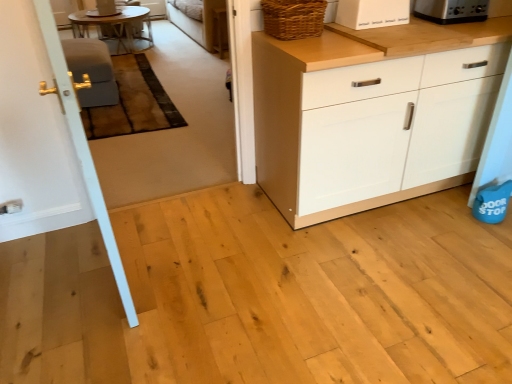
Describe the element at coordinates (293, 18) in the screenshot. This screenshot has width=512, height=384. I see `woven brown basket at upper right` at that location.

At what (x,y) coordinates should I click in order to perform the action: click on wooden round table at upper left. Please return your answer as a coordinate pair (x, y). Looking at the image, I should click on (116, 28).

What do you see at coordinates (46, 138) in the screenshot?
I see `white painted wood door at left` at bounding box center [46, 138].

Find the location of a particular element. beige fabric couch at upper center is located at coordinates (195, 19).

Is beige fabric couch at upper center positioned with its back to white wood cabinet at center?

beige fabric couch at upper center does not have its back to white wood cabinet at center.

Is point (167, 11) positioned before point (385, 38)?

No, (167, 11) is behind (385, 38).

Does beige fabric couch at upper center touch white wood cabinet at center?

No, beige fabric couch at upper center is not with white wood cabinet at center.

Looking at this image, considering the relative positions of beige fabric couch at upper center and white wood cabinet at center in the image provided, is beige fabric couch at upper center to the left or to the right of white wood cabinet at center?

In the image, beige fabric couch at upper center appears on the left side of white wood cabinet at center.

Considering the sizes of objects satin silver toaster at upper right, the 2th appliance viewed from the front, and white wood cabinet at center in the image provided, who is taller, satin silver toaster at upper right, the 2th appliance viewed from the front, or white wood cabinet at center?

With more height is white wood cabinet at center.

How far apart are satin silver toaster at upper right, the 2th appliance viewed from the front, and white wood cabinet at center?

satin silver toaster at upper right, the 2th appliance viewed from the front, and white wood cabinet at center are 23.24 inches apart.

From the image's perspective, is satin silver toaster at upper right, the 2th appliance viewed from the front, located above white wood cabinet at center?

Yes, from the image's perspective, satin silver toaster at upper right, the 2th appliance viewed from the front, is above white wood cabinet at center.

Considering the positions of point (432, 20) and point (384, 45), is point (432, 20) closer or farther from the camera than point (384, 45)?

Point (432, 20) is positioned farther from the camera compared to point (384, 45).

Consider the image. Is wooden round table at upper left at the back of white painted wood door at left?

No, white painted wood door at left is not facing away from wooden round table at upper left.

Is white painted wood door at left at the right side of wooden round table at upper left?

Yes, white painted wood door at left is to the right of wooden round table at upper left.

From a real-world perspective, between white painted wood door at left and wooden round table at upper left, who is vertically lower?

wooden round table at upper left, from a real-world perspective.

From a real-world perspective, does matte gray armchair at left stand above white painted wood door at left?

Actually, matte gray armchair at left is physically below white painted wood door at left in the real world.

How distant is matte gray armchair at left from white painted wood door at left?

The distance of matte gray armchair at left from white painted wood door at left is 1.78 meters.

Who is taller, matte gray armchair at left or white painted wood door at left?

white painted wood door at left is taller.

Is matte gray armchair at left positioned before white painted wood door at left?

That is False.

Which of these two, white matte bread box at upper right, which appears as the third appliance when viewed from the top, or white wood cabinet at center, is wider?

With larger width is white wood cabinet at center.

From the image's perspective, is white matte bread box at upper right, which is the 2th appliance from left to right, on top of white wood cabinet at center?

Yes.

Find the location of a particular element. basket that appears above the matte gray armchair at left (from a real-world perspective) is located at coordinates (293, 18).

Which of these two, woven brown basket at upper right or matte gray armchair at left, is bigger?

With larger size is matte gray armchair at left.

From the image's perspective, is white painted wood door at left on top of white wood cabinet at center?

No.

Is point (89, 207) closer or farther from the camera than point (358, 161)?

Point (89, 207).

Considering the sizes of white painted wood door at left and white wood cabinet at center in the image, is white painted wood door at left wider or thinner than white wood cabinet at center?

In the image, white painted wood door at left appears to be more narrow than white wood cabinet at center.

Where is `couch on the left side of white wood cabinet at center`? couch on the left side of white wood cabinet at center is located at coordinates (195, 19).

Locate an element on the screen. The height and width of the screenshot is (384, 512). appliance that is the 2nd object located above the white wood cabinet at center (from the image's perspective) is located at coordinates (451, 10).

Which object lies further to the anchor point beige fabric couch at upper center, woven brown basket at upper right or satin silver toaster at upper right, the 2th appliance when ordered from back to front?

Based on the image, satin silver toaster at upper right, the 2th appliance when ordered from back to front, appears to be further to beige fabric couch at upper center.

Which object lies further to the anchor point beige fabric couch at upper center, white wood cabinet at center or matte gray armchair at left?

white wood cabinet at center is further to beige fabric couch at upper center.

Based on the photo, estimate the real-world distances between objects in this image. Which object is further from white matte bread box at upper right, which is the second appliance in right-to-left order, woven brown basket at upper right or white painted wood door at left?

The object further to white matte bread box at upper right, which is the second appliance in right-to-left order, is white painted wood door at left.

Considering their positions, is matte gray armchair at left positioned closer to white wood cabinet at center than metallic silver toaster at upper left, the 3th appliance from the bottom?

matte gray armchair at left lies closer to white wood cabinet at center than the other object.

Looking at this image, from the image, which object appears to be farther from beige fabric couch at upper center, white painted wood door at left or matte gray armchair at left?

Among the two, white painted wood door at left is located further to beige fabric couch at upper center.

Based on their spatial positions, is matte gray armchair at left or white matte bread box at upper right, which is the 1th appliance in front-to-back order, closer to satin silver toaster at upper right, which appears as the first appliance when viewed from the right?

Among the two, white matte bread box at upper right, which is the 1th appliance in front-to-back order, is located nearer to satin silver toaster at upper right, which appears as the first appliance when viewed from the right.

Considering their positions, is wooden round table at upper left positioned further to matte gray armchair at left than white matte bread box at upper right, which appears as the third appliance when viewed from the top?

white matte bread box at upper right, which appears as the third appliance when viewed from the top, is further to matte gray armchair at left.

Looking at this image, when comparing their distances from satin silver toaster at upper right, which appears as the first appliance when viewed from the right, does metallic silver toaster at upper left, marked as the first appliance in a left-to-right arrangement, or beige fabric couch at upper center seem further?

metallic silver toaster at upper left, marked as the first appliance in a left-to-right arrangement, is further to satin silver toaster at upper right, which appears as the first appliance when viewed from the right.

Find the location of a particular element. This screenshot has width=512, height=384. couch between white matte bread box at upper right, which is the first appliance from bottom to top, and wooden round table at upper left in the front-back direction is located at coordinates (195, 19).

The image size is (512, 384). Find the location of `armchair between wooden round table at upper left and satin silver toaster at upper right, which appears as the 2th appliance when viewed from the top, in the horizontal direction`. armchair between wooden round table at upper left and satin silver toaster at upper right, which appears as the 2th appliance when viewed from the top, in the horizontal direction is located at coordinates (91, 71).

Find the location of `couch between white painted wood door at left and wooden round table at upper left from front to back`. couch between white painted wood door at left and wooden round table at upper left from front to back is located at coordinates [x=195, y=19].

The image size is (512, 384). Identify the location of basket located between white painted wood door at left and metallic silver toaster at upper left, the 1th appliance viewed from the top, in the depth direction. (293, 18).